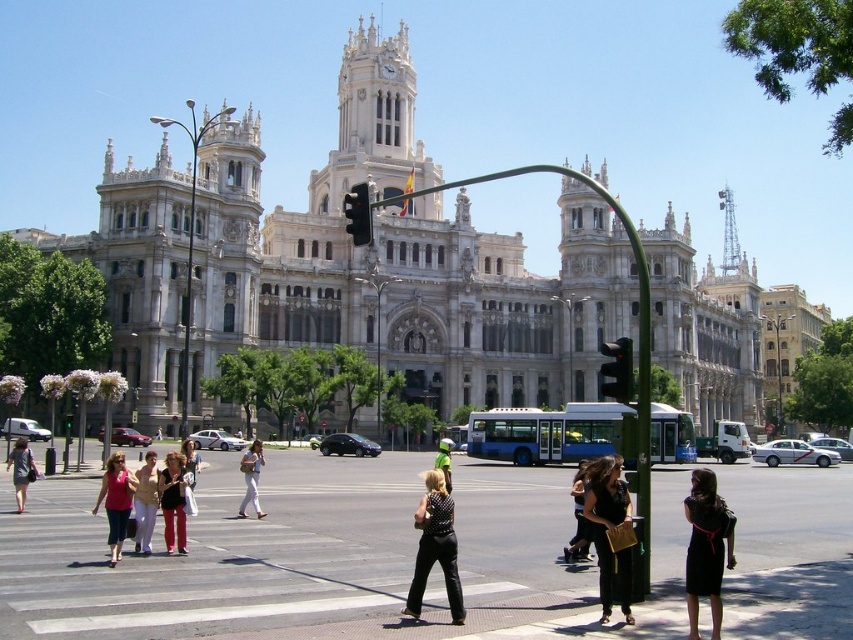
Does black leather dress at center have a larger size compared to black dress at center?

No.

Between point (608, 589) and point (579, 547), which one is positioned in front?

Point (608, 589) is more forward.

Locate an element on the screen. black leather dress at center is located at coordinates (608, 531).

Which is below, black leather dress at center or matte black dress at lower left?

black leather dress at center is below.

Does point (619, 570) come in front of point (28, 454)?

Yes, point (619, 570) is closer to viewer.

Where is `black leather dress at center`? black leather dress at center is located at coordinates (608, 531).

Identify the location of light beige pants at center. The image size is (853, 640). (144, 502).

Who is higher up, light beige pants at center or green reflective vest at center?

light beige pants at center is above.

At what (x,y) coordinates should I click in order to perform the action: click on light beige pants at center. Please return your answer as a coordinate pair (x, y). Looking at the image, I should click on (144, 502).

The width and height of the screenshot is (853, 640). What are the coordinates of `light beige pants at center` in the screenshot? It's located at (144, 502).